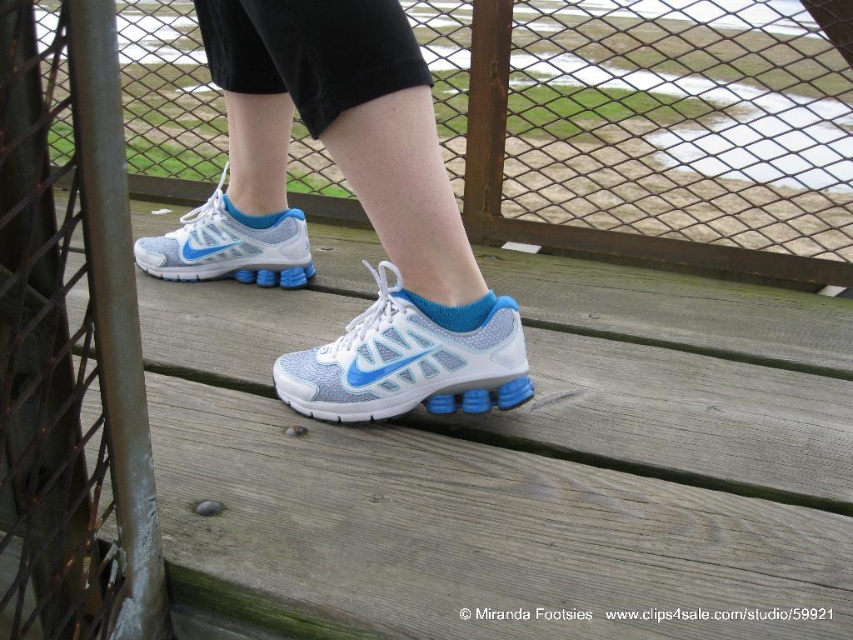
From the picture: You are standing on the wooden deck and need to locate the green metal pole at left. According to the coordinates provided, where should you look to find it?

The green metal pole at left is located at point coordinates of (70, 346).

You are a painter who needs to paint the green metal pole at left and the light blue mesh shoe at center. You have a 12 inch long paintbrush. Can you reach both objects without moving your position?

The green metal pole at left and light blue mesh shoe at center are 16.03 inches apart. Since your paintbrush is only 12 inches long, you cannot reach both objects without moving your position because the distance between them exceeds the brush length.

You are a painter who needs to paint a green metal pole at left and a matte mesh shoe at center. The spray can you have can only spray up to 18 inches. Can you paint both objects without moving the spray can?

The green metal pole at left is 18.21 inches away from matte mesh shoe at center. Since the spray can can only spray up to 18 inches, you cannot paint both objects without moving the spray can because the distance between them exceeds the spray can range.